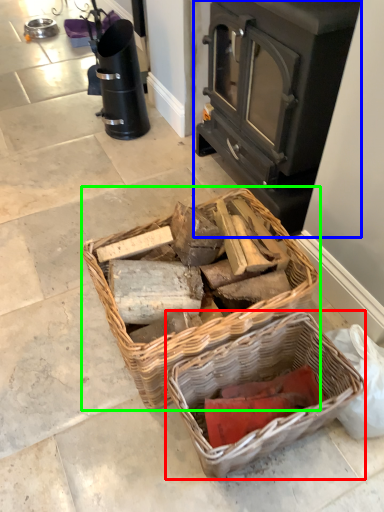
Question: Estimate the real-world distances between objects in this image. Which object is closer to picnic basket (highlighted by a red box), wood burning stove (highlighted by a blue box) or picnic basket (highlighted by a green box)?

Choices:
 (A) wood burning stove
 (B) picnic basket

Answer: (B)